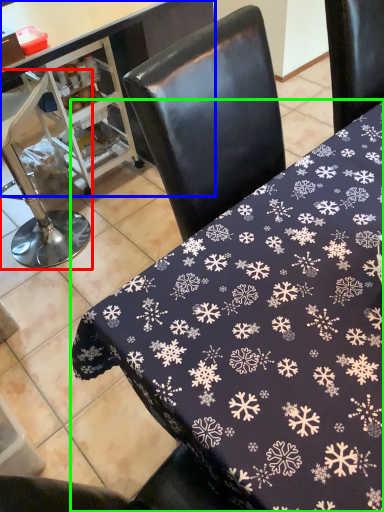
Question: Estimate the real-world distances between objects in this image. Which object is farther from chair (highlighted by a red box), table (highlighted by a blue box) or table (highlighted by a green box)?

Choices:
 (A) table
 (B) table

Answer: (B)